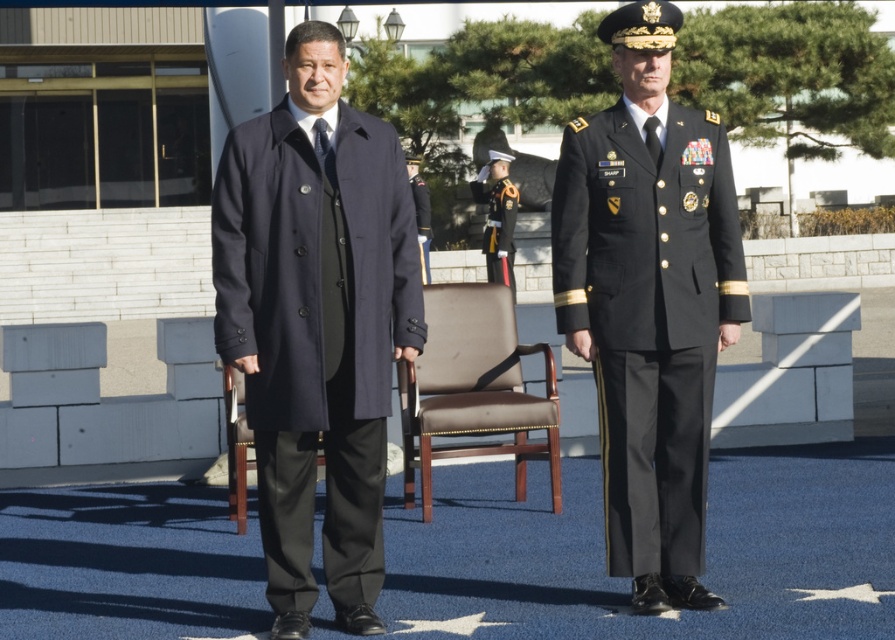
Question: Does navy wool coat at center come behind black glossy uniform at center?

Choices:
 (A) no
 (B) yes

Answer: (A)

Question: Is navy wool coat at center in front of black leather gloves at center?

Choices:
 (A) no
 (B) yes

Answer: (B)

Question: Does brown leather chair at center have a smaller size compared to black glossy uniform at center?

Choices:
 (A) yes
 (B) no

Answer: (A)

Question: Which is farther from the black glossy military uniform at center?

Choices:
 (A) black leather gloves at center
 (B) black glossy uniform at center

Answer: (A)

Question: Which point is farther from the camera taking this photo?

Choices:
 (A) (397, 365)
 (B) (595, 337)
 (C) (423, 193)
 (D) (513, 246)

Answer: (C)

Question: Among these objects, which one is farthest from the camera?

Choices:
 (A) brown leather chair at center
 (B) black leather gloves at center
 (C) black glossy uniform at center

Answer: (B)